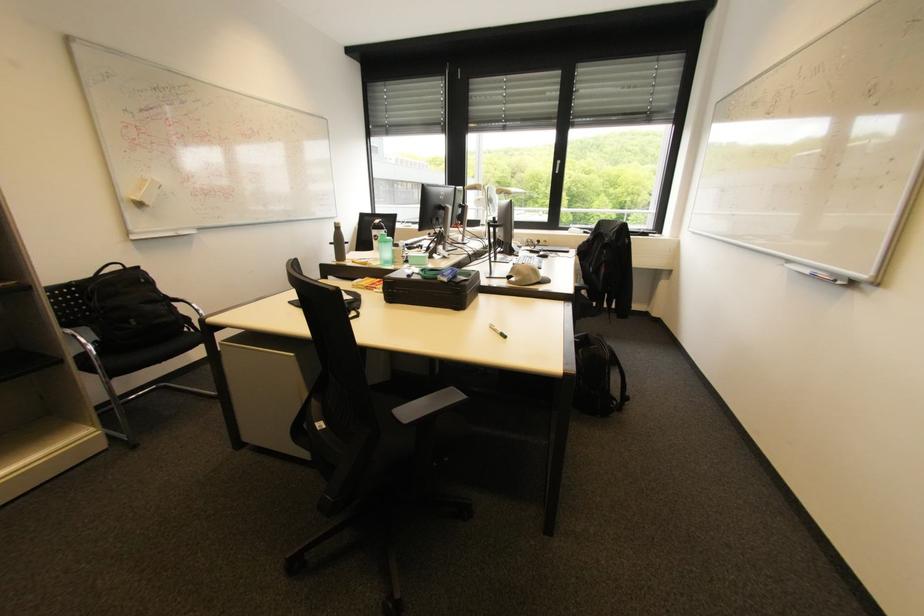
What do you see at coordinates (400, 376) in the screenshot?
I see `the black chair sitting surface` at bounding box center [400, 376].